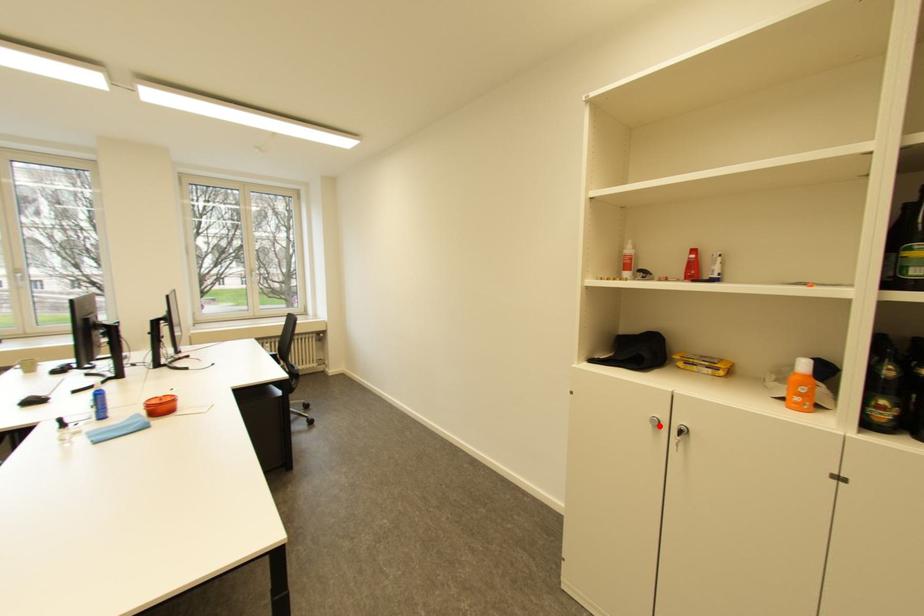
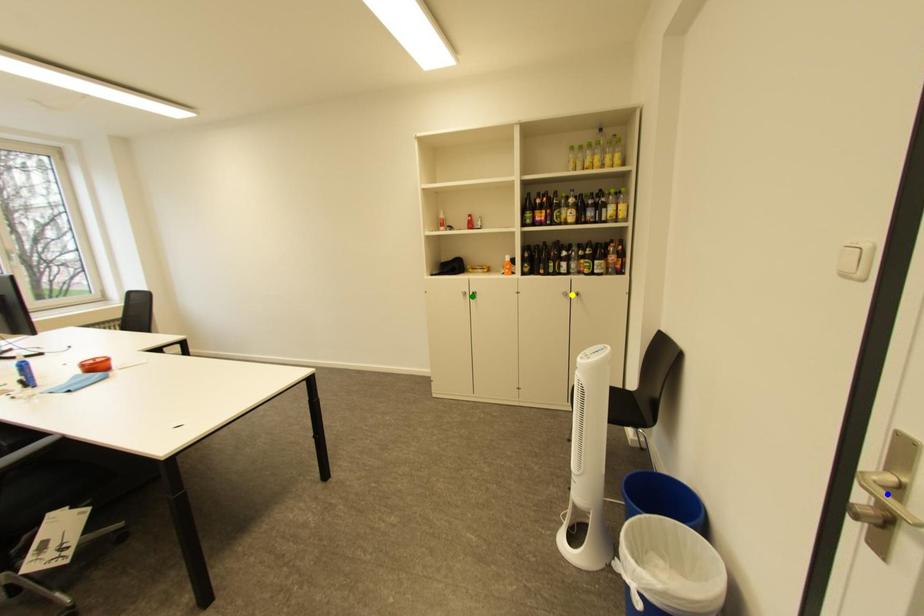
Question: I am providing you with two images of the same scene from different viewpoints. A red point is marked on the first image. You are given multiple points on the second image. Which mark in image 2 goes with the point in image 1?

Choices:
 (A) green point
 (B) yellow point
 (C) blue point

Answer: (A)